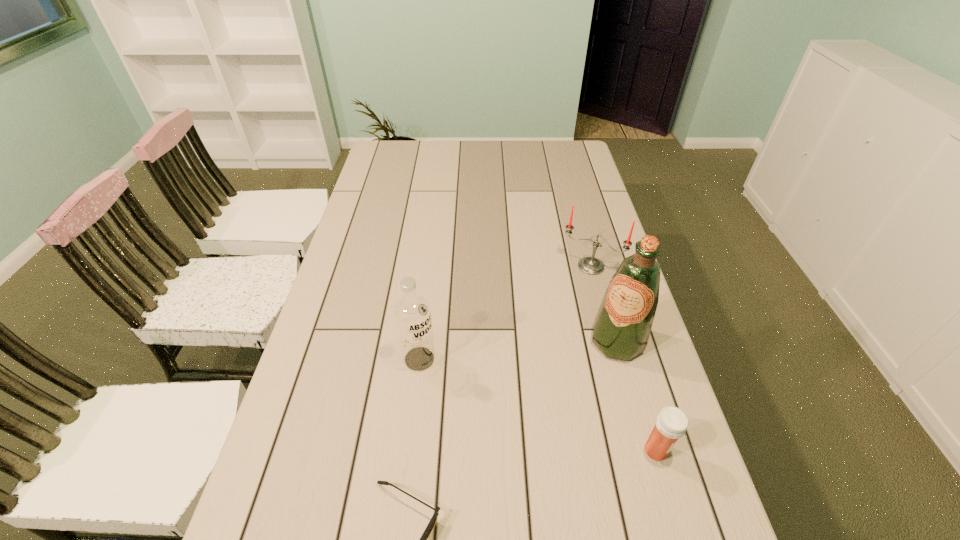
Where is `free region located on the front label of the second tallest object`? free region located on the front label of the second tallest object is located at coordinates (462, 415).

At what (x,y) coordinates should I click in order to perform the action: click on free space located on the front label of the second tallest object. Please return your answer as a coordinate pair (x, y). This screenshot has width=960, height=540. Looking at the image, I should click on (449, 400).

Locate an element on the screen. free region located 0.250m on the front-facing side of the farthest object is located at coordinates (557, 335).

The height and width of the screenshot is (540, 960). In order to click on vacant point located on the front-facing side of the farthest object in this screenshot , I will do `click(551, 349)`.

The image size is (960, 540). Identify the location of vacant space situated 0.150m on the front-facing side of the farthest object. (567, 310).

Find the location of a particular element. This screenshot has height=540, width=960. medicine located in the right edge section of the desktop is located at coordinates (671, 424).

Locate an element on the screen. This screenshot has height=540, width=960. olive oil that is at the right edge is located at coordinates (622, 326).

Locate an element on the screen. candle present at the right edge is located at coordinates (590, 265).

The width and height of the screenshot is (960, 540). In the image, there is a desktop. In order to click on vacant space at the far edge in this screenshot , I will do `click(421, 156)`.

Where is `free region at the left edge`? This screenshot has height=540, width=960. free region at the left edge is located at coordinates (336, 357).